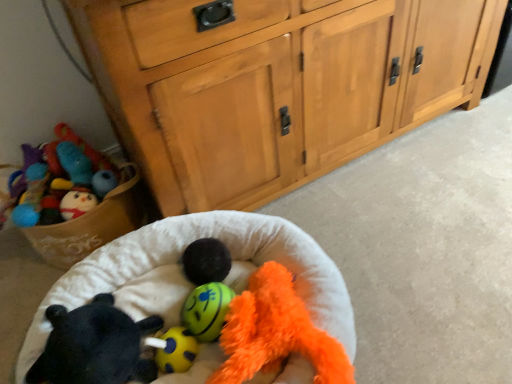
Image resolution: width=512 pixels, height=384 pixels. Describe the element at coordinates (206, 261) in the screenshot. I see `black fuzzy ball at center` at that location.

The width and height of the screenshot is (512, 384). What do you see at coordinates (275, 332) in the screenshot?
I see `fluffy orange stuffed animal at center, which is the first toy from right to left` at bounding box center [275, 332].

You are a GUI agent. You are given a task and a screenshot of the screen. Output one action in this format:
    pyautogui.click(x=<x>, y=<y>)
    Task: Click on the fluffy orange stuffed animal at center, which is the first toy from right to left
    
    Given the screenshot: What is the action you would take?
    pyautogui.click(x=275, y=332)

Locate an element on the screen. The image size is (512, 384). black plush bear at lower left, positioned as the 4th toy in right-to-left order is located at coordinates (95, 346).

The width and height of the screenshot is (512, 384). Describe the element at coordinates (173, 349) in the screenshot. I see `yellow rubber ball at center, which is the 2th toy in left-to-right order` at that location.

This screenshot has width=512, height=384. Identify the location of black fuzzy ball at center. (206, 261).

How different are the orientations of black plush bear at lower left, positioned as the 4th toy in right-to-left order, and wooden cabinet at center in degrees?

They differ by 66 degrees in their facing directions.

Considering the relative sizes of black plush bear at lower left, placed as the first toy when sorted from left to right, and wooden cabinet at center in the image provided, is black plush bear at lower left, placed as the first toy when sorted from left to right, shorter than wooden cabinet at center?

Indeed, black plush bear at lower left, placed as the first toy when sorted from left to right, has a lesser height compared to wooden cabinet at center.

Does black plush bear at lower left, positioned as the 4th toy in right-to-left order, lie in front of wooden cabinet at center?

No, black plush bear at lower left, positioned as the 4th toy in right-to-left order, is further to the viewer.

From a real-world perspective, is black plush bear at lower left, placed as the first toy when sorted from left to right, on top of wooden cabinet at center?

No, from a real-world perspective, black plush bear at lower left, placed as the first toy when sorted from left to right, is not above wooden cabinet at center.

From a real-world perspective, who is located lower, black plush bear at lower left, positioned as the 4th toy in right-to-left order, or yellow rubber ball at center, which is the 3th toy in left-to-right order?

yellow rubber ball at center, which is the 3th toy in left-to-right order, is physically lower.

Between point (161, 318) and point (202, 338), which one is positioned in front?

The point (202, 338) is more forward.

Can you confirm if black plush bear at lower left, positioned as the 4th toy in right-to-left order, is shorter than yellow rubber ball at center, which is the 3th toy in left-to-right order?

No, black plush bear at lower left, positioned as the 4th toy in right-to-left order, is not shorter than yellow rubber ball at center, which is the 3th toy in left-to-right order.

Is wooden cabinet at center at the left side of fluffy orange stuffed animal at center, the fourth toy when ordered from left to right?

Incorrect, wooden cabinet at center is not on the left side of fluffy orange stuffed animal at center, the fourth toy when ordered from left to right.

Between point (111, 5) and point (292, 302), which one is positioned behind?

The point (292, 302) is more distant.

Is there a large distance between wooden cabinet at center and fluffy orange stuffed animal at center, the fourth toy when ordered from left to right?

That's not correct — wooden cabinet at center is a little close to fluffy orange stuffed animal at center, the fourth toy when ordered from left to right.

From a real-world perspective, is wooden cabinet at center physically above fluffy orange stuffed animal at center, the fourth toy when ordered from left to right?

Yes, from a real-world perspective, wooden cabinet at center is over fluffy orange stuffed animal at center, the fourth toy when ordered from left to right

The image size is (512, 384). In order to click on animal behind the yellow rubber ball at center, which is the 3th toy in left-to-right order in this screenshot , I will do `click(206, 261)`.

Is black fuzzy ball at center at the back of yellow rubber ball at center, arranged as the second toy when viewed from the right?

yellow rubber ball at center, arranged as the second toy when viewed from the right, does not have its back to black fuzzy ball at center.

From a real-world perspective, is yellow rubber ball at center, which is the 3th toy in left-to-right order, positioned above or below black fuzzy ball at center?

From a real-world perspective, yellow rubber ball at center, which is the 3th toy in left-to-right order, is physically below black fuzzy ball at center.

Can you confirm if soft plush infant bed at center is taller than wooden cabinet at center?

No.

Are soft plush infant bed at center and wooden cabinet at center beside each other?

No, soft plush infant bed at center is not beside wooden cabinet at center.

How much distance is there between soft plush infant bed at center and wooden cabinet at center?

The distance of soft plush infant bed at center from wooden cabinet at center is 16.47 inches.

Does point (220, 250) appear closer or farther from the camera than point (234, 344)?

Point (220, 250) appears to be farther away from the viewer than point (234, 344).

Would you consider black fuzzy ball at center to be distant from fluffy orange stuffed animal at center, the fourth toy when ordered from left to right?

Actually, black fuzzy ball at center and fluffy orange stuffed animal at center, the fourth toy when ordered from left to right, are a little close together.

Does black fuzzy ball at center come behind fluffy orange stuffed animal at center, which is the first toy from right to left?

Yes, black fuzzy ball at center is further from the camera.

In terms of height, does black fuzzy ball at center look taller or shorter compared to soft plush infant bed at center?

In the image, black fuzzy ball at center appears to be shorter than soft plush infant bed at center.

Which of these two, black fuzzy ball at center or soft plush infant bed at center, is bigger?

soft plush infant bed at center.

Which is closer, (224, 251) or (71, 305)?

Point (224, 251) is positioned farther from the camera compared to point (71, 305).

Considering the relative sizes of black fuzzy ball at center and soft plush infant bed at center in the image provided, is black fuzzy ball at center wider than soft plush infant bed at center?

No.

Locate an element on the screen. This screenshot has width=512, height=384. the 3rd toy below the wooden cabinet at center (from the image's perspective) is located at coordinates (95, 346).

Locate an element on the screen. the 2nd toy located above the yellow rubber ball at center, arranged as the second toy when viewed from the right (from a real-world perspective) is located at coordinates (95, 346).

Which object lies further to the anchor point fluffy orange stuffed animal at center, which is the first toy from right to left, wooden cabinet at center or black fuzzy ball at center?

The object further to fluffy orange stuffed animal at center, which is the first toy from right to left, is wooden cabinet at center.

Estimate the real-world distances between objects in this image. Which object is further from soft plush infant bed at center, yellow rubber ball at center, arranged as the second toy when viewed from the right, or fluffy orange stuffed animal at center, which is the first toy from right to left?

yellow rubber ball at center, arranged as the second toy when viewed from the right, is further to soft plush infant bed at center.

Estimate the real-world distances between objects in this image. Which object is further from wooden cabinet at center, yellow rubber ball at center, arranged as the second toy when viewed from the right, or black fuzzy ball at center?

The object further to wooden cabinet at center is yellow rubber ball at center, arranged as the second toy when viewed from the right.

Considering their positions, is yellow rubber ball at center, arranged as the second toy when viewed from the right, positioned further to black fuzzy ball at center than yellow rubber ball at center, the third toy when ordered from right to left?

yellow rubber ball at center, the third toy when ordered from right to left, lies further to black fuzzy ball at center than the other object.

Considering their positions, is black plush bear at lower left, placed as the first toy when sorted from left to right, positioned closer to black fuzzy ball at center than yellow rubber ball at center, which is the 3th toy in left-to-right order?

Among the two, yellow rubber ball at center, which is the 3th toy in left-to-right order, is located nearer to black fuzzy ball at center.

Looking at this image, based on their spatial positions, is black fuzzy ball at center or yellow rubber ball at center, which is the 3th toy in left-to-right order, further from fluffy orange stuffed animal at center, the fourth toy when ordered from left to right?

The object further to fluffy orange stuffed animal at center, the fourth toy when ordered from left to right, is black fuzzy ball at center.

From the image, which object appears to be nearer to fluffy orange stuffed animal at center, the fourth toy when ordered from left to right, soft plush infant bed at center or black plush bear at lower left, placed as the first toy when sorted from left to right?

soft plush infant bed at center.

In the scene shown: When comparing their distances from yellow rubber ball at center, arranged as the second toy when viewed from the right, does fluffy orange stuffed animal at center, which is the first toy from right to left, or wooden cabinet at center seem further?

wooden cabinet at center is further to yellow rubber ball at center, arranged as the second toy when viewed from the right.

You are a GUI agent. You are given a task and a screenshot of the screen. Output one action in this format:
    pyautogui.click(x=<x>, y=<y>)
    Task: Click on the infant bed between wooden cabinet at center and yellow rubber ball at center, which is the 3th toy in left-to-right order, in the vertical direction
    
    Given the screenshot: What is the action you would take?
    pyautogui.click(x=179, y=257)

Where is `animal between wooden cabinet at center and black plush bear at lower left, positioned as the 4th toy in right-to-left order, in the vertical direction`? animal between wooden cabinet at center and black plush bear at lower left, positioned as the 4th toy in right-to-left order, in the vertical direction is located at coordinates (206, 261).

You are a GUI agent. You are given a task and a screenshot of the screen. Output one action in this format:
    pyautogui.click(x=<x>, y=<y>)
    Task: Click on the infant bed situated between black plush bear at lower left, placed as the first toy when sorted from left to right, and fluffy orange stuffed animal at center, which is the first toy from right to left, from left to right
    
    Given the screenshot: What is the action you would take?
    pyautogui.click(x=179, y=257)

The width and height of the screenshot is (512, 384). What are the coordinates of `infant bed between wooden cabinet at center and fluffy orange stuffed animal at center, which is the first toy from right to left, in the vertical direction` in the screenshot? It's located at (179, 257).